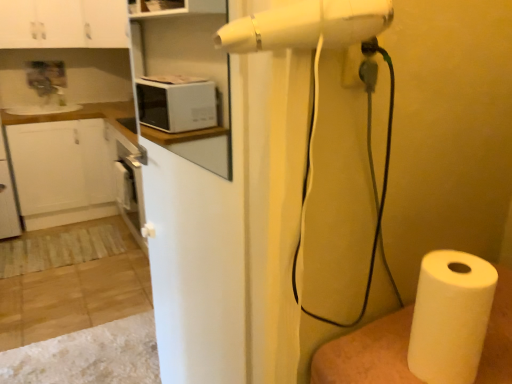
Identify the location of vacant space to the right of white paper at lower right. (496, 349).